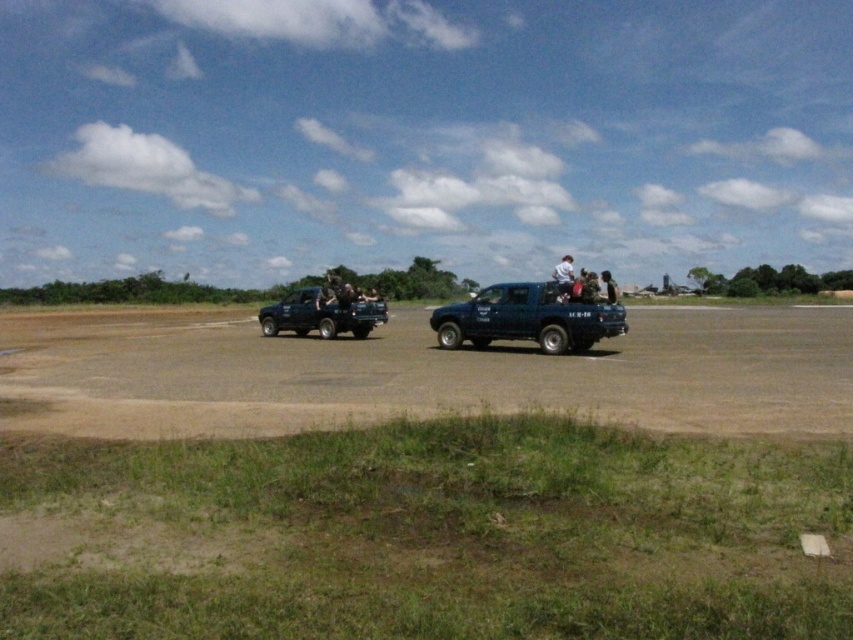
Question: Which object appears farthest from the camera in this image?

Choices:
 (A) matte dark green truck at left
 (B) matte blue truck at center

Answer: (A)

Question: Which of these objects is positioned closest to the matte dark green truck at left?

Choices:
 (A) white matte shirt at center
 (B) matte blue truck at center

Answer: (B)

Question: Does matte blue truck at center appear on the left side of matte dark green truck at left?

Choices:
 (A) yes
 (B) no

Answer: (B)

Question: Is matte dark green truck at left closer to camera compared to white matte shirt at center?

Choices:
 (A) no
 (B) yes

Answer: (A)

Question: Which point appears closest to the camera in this image?

Choices:
 (A) (482, 298)
 (B) (567, 292)

Answer: (B)

Question: Is matte blue truck at center above matte dark green truck at left?

Choices:
 (A) no
 (B) yes

Answer: (A)